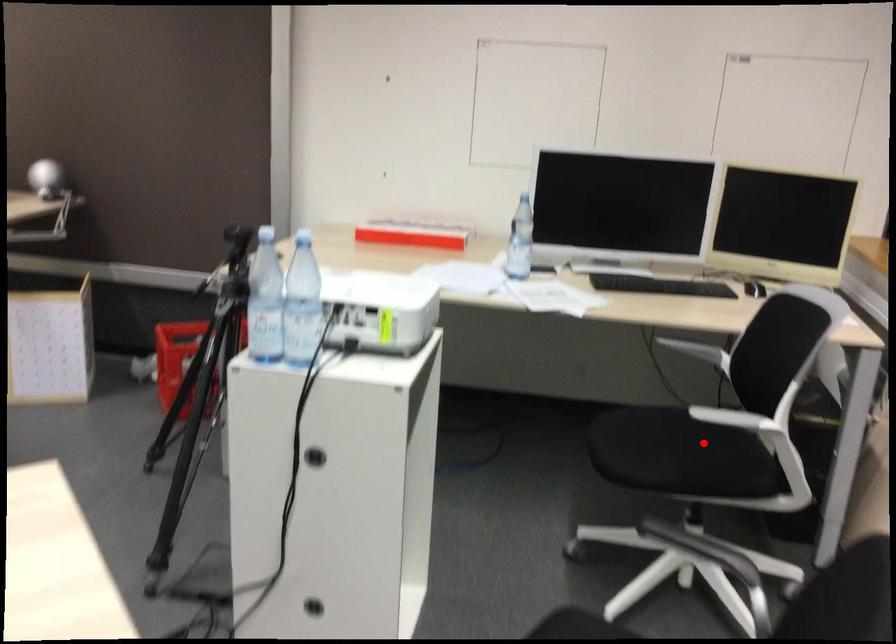
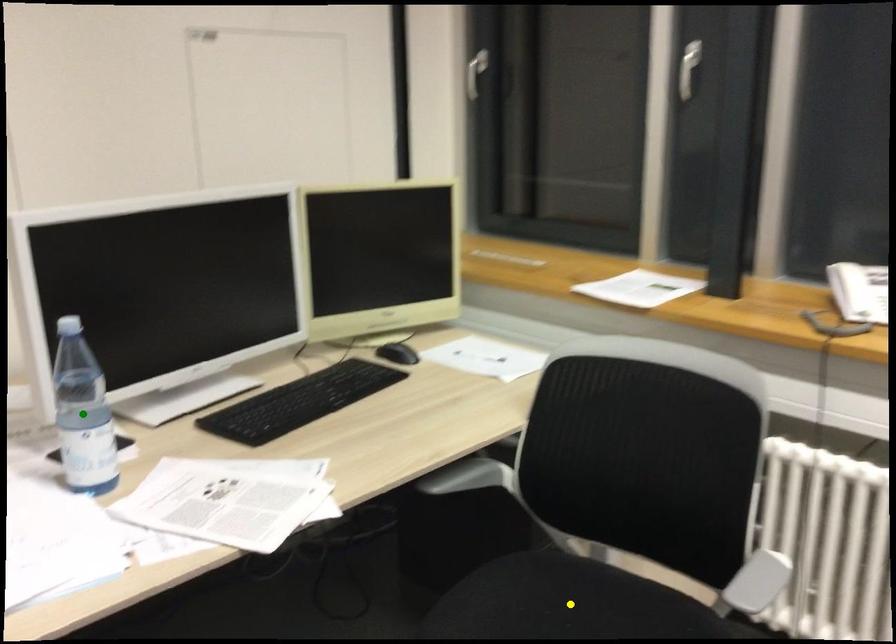
Question: I am providing you with two images of the same scene from different viewpoints. A red point is marked on the first image. You are given multiple points on the second image. In image 2, which mark is for the same physical point as the one in image 1?

Choices:
 (A) blue point
 (B) green point
 (C) yellow point

Answer: (C)